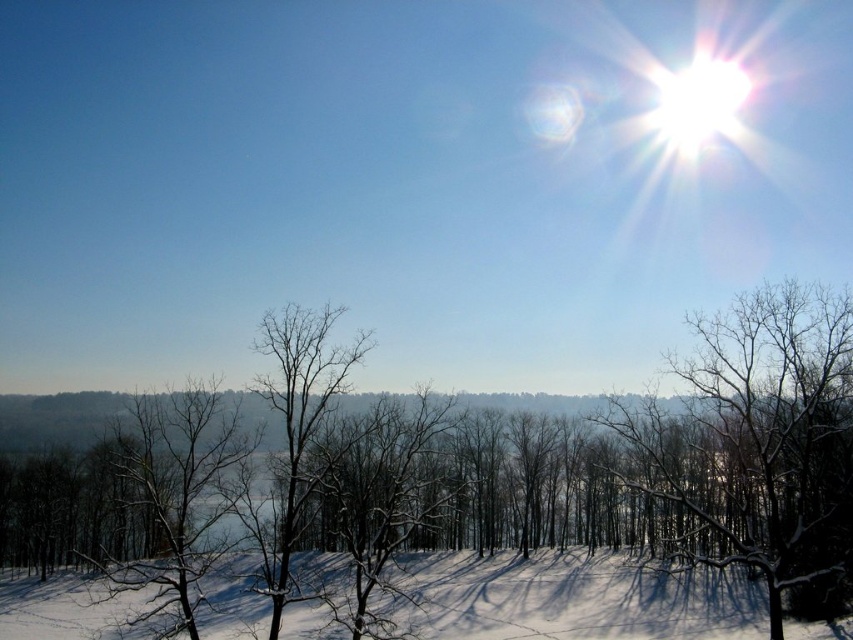
Question: Estimate the real-world distances between objects in this image. Which object is closer to the white snow at lower center?

Choices:
 (A) snowy bare tree at center
 (B) snow-covered branches at right

Answer: (A)

Question: Which object appears closest to the camera in this image?

Choices:
 (A) snowy bare tree at center
 (B) white snow at lower center
 (C) snow-covered branches at right

Answer: (A)

Question: Does snowy bare tree at center have a smaller size compared to snow-covered branches at right?

Choices:
 (A) no
 (B) yes

Answer: (A)

Question: Can you confirm if snowy bare tree at center is thinner than white snow at lower center?

Choices:
 (A) no
 (B) yes

Answer: (A)

Question: Which of the following is the farthest from the observer?

Choices:
 (A) snowy bare tree at center
 (B) snow-covered branches at right

Answer: (B)

Question: Can you confirm if snowy bare tree at center is positioned to the right of snow-covered branches at right?

Choices:
 (A) yes
 (B) no

Answer: (B)